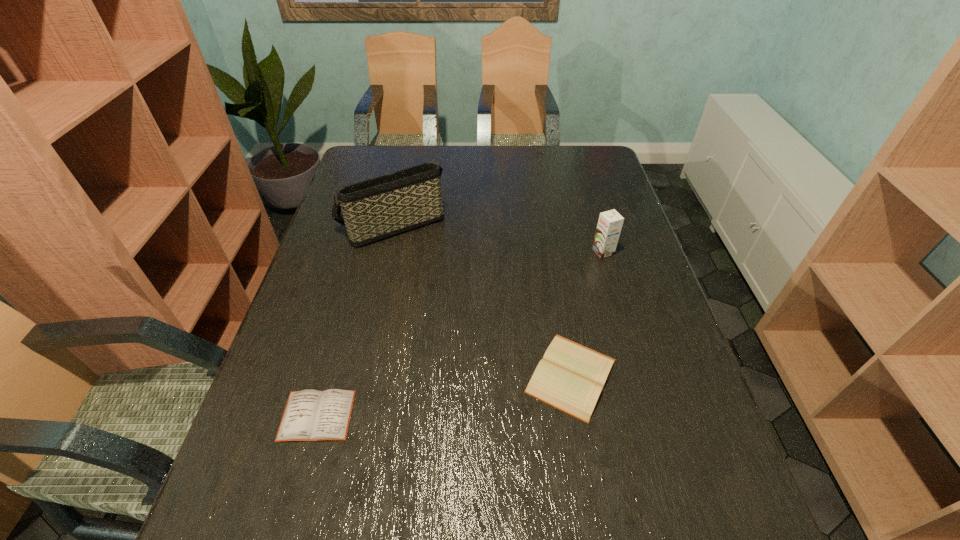
Where is `vacant space that's between the third tallest object and the left diary`? vacant space that's between the third tallest object and the left diary is located at coordinates (444, 396).

Find the location of `blank region between the third shortest object and the handbag`. blank region between the third shortest object and the handbag is located at coordinates (497, 239).

You are a GUI agent. You are given a task and a screenshot of the screen. Output one action in this format:
    pyautogui.click(x=<x>, y=<y>)
    Task: Click on the empty location between the third tallest object and the third shortest object
    
    Given the screenshot: What is the action you would take?
    pyautogui.click(x=588, y=314)

I want to click on free point between the chocolate milk and the left diary, so click(460, 334).

I want to click on unoccupied area between the chocolate milk and the left diary, so click(460, 334).

Where is `free point between the shortest object and the third shortest object`? This screenshot has width=960, height=540. free point between the shortest object and the third shortest object is located at coordinates (460, 334).

Where is `free area in between the third tallest object and the tallest object`? The image size is (960, 540). free area in between the third tallest object and the tallest object is located at coordinates (482, 300).

You are a GUI agent. You are given a task and a screenshot of the screen. Output one action in this format:
    pyautogui.click(x=<x>, y=<y>)
    Task: Click on the free space between the third tallest object and the tallest object
    This screenshot has height=540, width=960.
    Given the screenshot: What is the action you would take?
    pyautogui.click(x=482, y=300)

The height and width of the screenshot is (540, 960). I want to click on free spot between the shortest object and the third tallest object, so pyautogui.click(x=444, y=396).

This screenshot has width=960, height=540. What are the coordinates of `vacant area between the second shortest object and the shorter diary` in the screenshot? It's located at (444, 396).